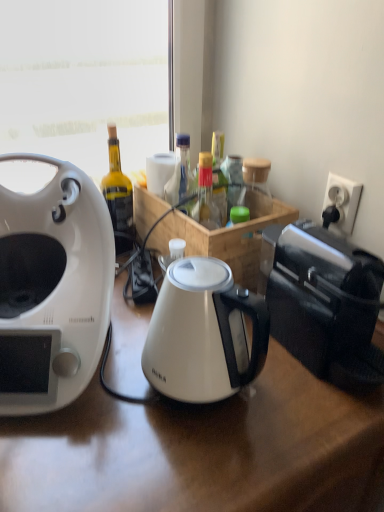
The height and width of the screenshot is (512, 384). Identify the location of empty space that is ontop of black plastic toaster at right. (328, 251).